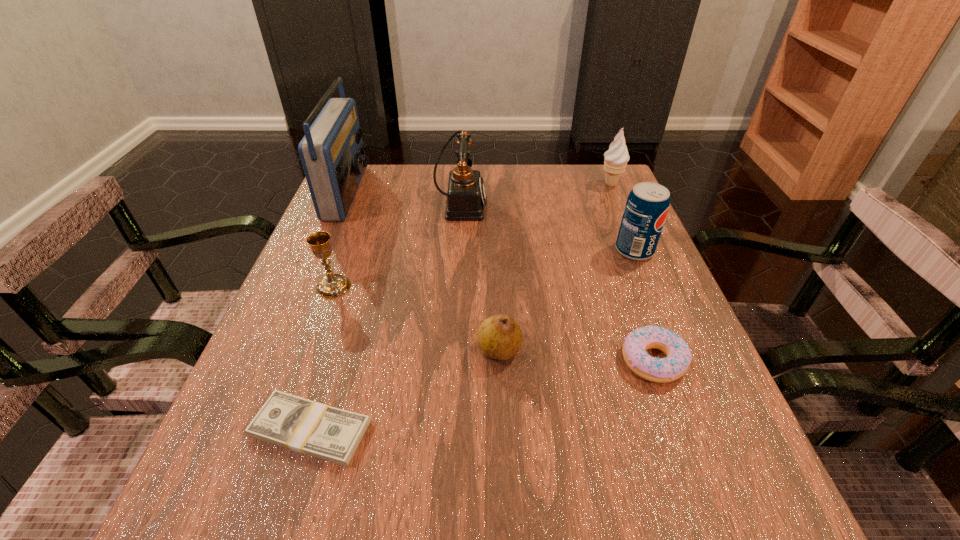
Find the location of a particular element. The image size is (960, 540). icecream situated at the far edge is located at coordinates (616, 158).

Locate an element on the screen. This screenshot has height=540, width=960. radio receiver that is at the left edge is located at coordinates (332, 153).

Where is `chalice present at the left edge`? chalice present at the left edge is located at coordinates (332, 285).

Find the location of a particular element. Image resolution: width=960 pixels, height=540 pixels. dollar positioned at the left edge is located at coordinates (301, 425).

Image resolution: width=960 pixels, height=540 pixels. Find the location of `icecream that is at the right edge`. icecream that is at the right edge is located at coordinates (616, 158).

You are a GUI agent. You are given a task and a screenshot of the screen. Output one action in this format:
    pyautogui.click(x=<x>, y=<y>)
    Task: Click on the pop that is positioned at the right edge
    This screenshot has width=960, height=540.
    Given the screenshot: What is the action you would take?
    pyautogui.click(x=647, y=205)

At what (x,y) coordinates should I click in order to perform the action: click on doughnut that is at the right edge. Please return your answer as a coordinate pair (x, y). This screenshot has width=960, height=540. Looking at the image, I should click on (659, 370).

Where is `object present at the far left corner`? This screenshot has height=540, width=960. object present at the far left corner is located at coordinates (332, 153).

Identify the location of object present at the far right corner. The height and width of the screenshot is (540, 960). (616, 158).

The image size is (960, 540). Find the location of `blank area at the far edge`. blank area at the far edge is located at coordinates (498, 198).